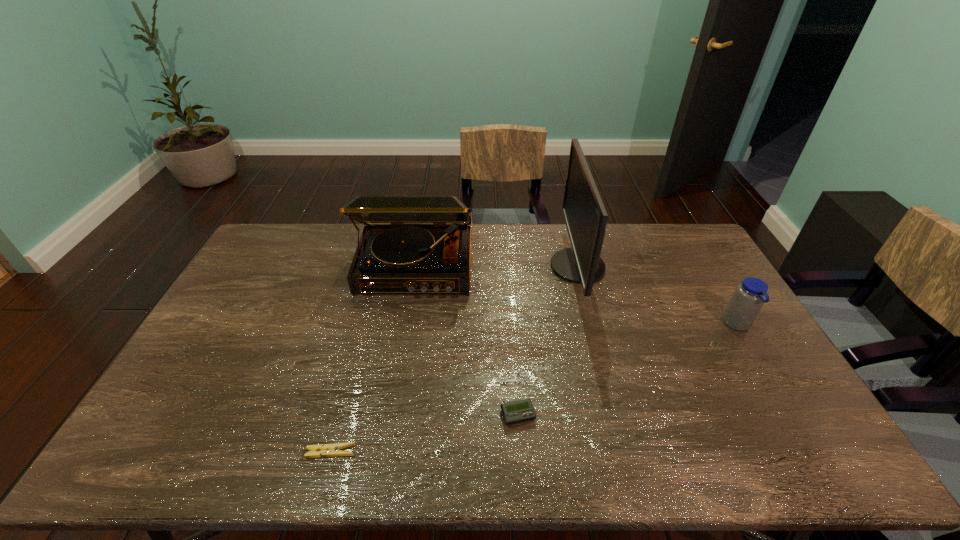
I want to click on free location that satisfies the following two spatial constraints: 1. with a carrying loop on the side of the rightmost object; 2. on the front side of the third object from right to left, so click(x=791, y=415).

Find the location of `vacant space that satisfies the following two spatial constraints: 1. with a carrying loop on the side of the rightmost object; 2. on the front side of the shortest object`. vacant space that satisfies the following two spatial constraints: 1. with a carrying loop on the side of the rightmost object; 2. on the front side of the shortest object is located at coordinates (813, 452).

At what (x,y) coordinates should I click in order to perform the action: click on free space that satisfies the following two spatial constraints: 1. on the front-facing side of the second nearest object; 2. on the left side of the record player. Please return your answer as a coordinate pair (x, y). The image size is (960, 540). Looking at the image, I should click on (391, 415).

At what (x,y) coordinates should I click in order to perform the action: click on free spot that satisfies the following two spatial constraints: 1. on the screen side of the second object from right to left; 2. on the front side of the third object from right to left. Please return your answer as a coordinate pair (x, y). Looking at the image, I should click on (616, 415).

This screenshot has width=960, height=540. Find the location of `vacant space that satisfies the following two spatial constraints: 1. on the screen side of the second object from right to left; 2. on the front-facing side of the record player`. vacant space that satisfies the following two spatial constraints: 1. on the screen side of the second object from right to left; 2. on the front-facing side of the record player is located at coordinates (578, 267).